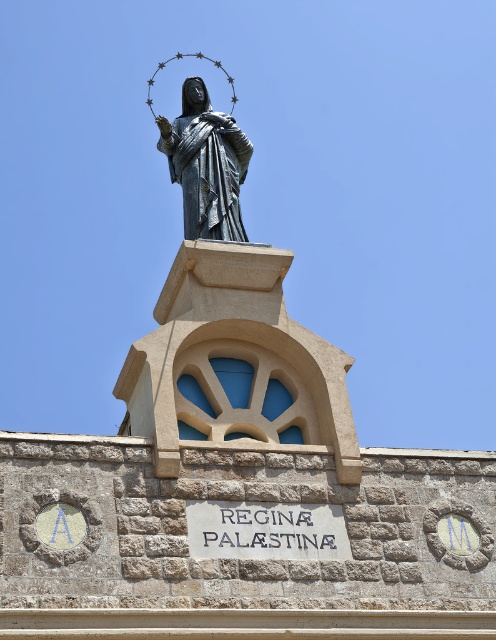
You are an art conservator assessing the placement of the polished bronze statue at center and the white stone sign at center. Which object is located higher in the scene?

The polished bronze statue at center is positioned over the white stone sign at center, so it is higher in the scene.

You are an art conservator assessing the statue and sign. Given that the polished bronze statue at center is wider than the white stone sign at center, which object would require a larger protective covering to fully enclose it?

The polished bronze statue at center requires a larger protective covering because its width surpasses that of the white stone sign at center.

You are an art conservator examining the statue and sign. From your vantage point, which object is closer to you, the polished bronze statue at center or the white stone sign at center?

The polished bronze statue at center is closer to you because the white stone sign at center is behind it.